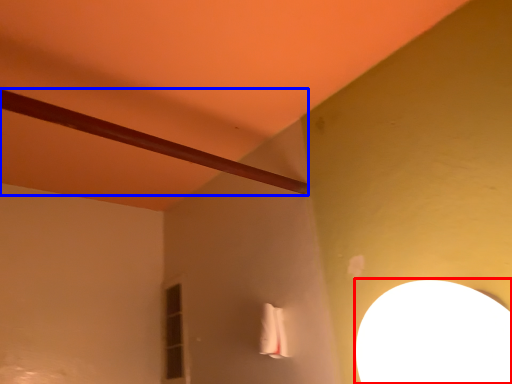
Question: Which point is further to the camera, lamp (highlighted by a red box) or beam (highlighted by a blue box)?

Choices:
 (A) lamp
 (B) beam

Answer: (B)